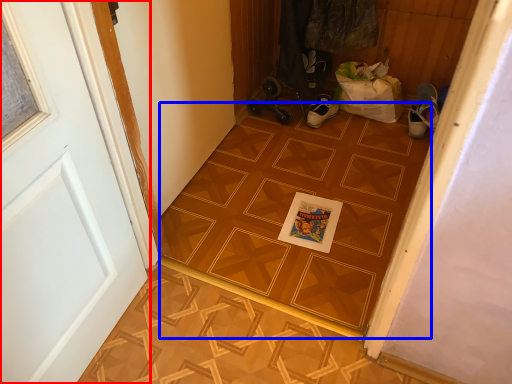
Question: Which point is closer to the camera, door (highlighted by a red box) or ceramic tile (highlighted by a blue box)?

Choices:
 (A) door
 (B) ceramic tile

Answer: (A)